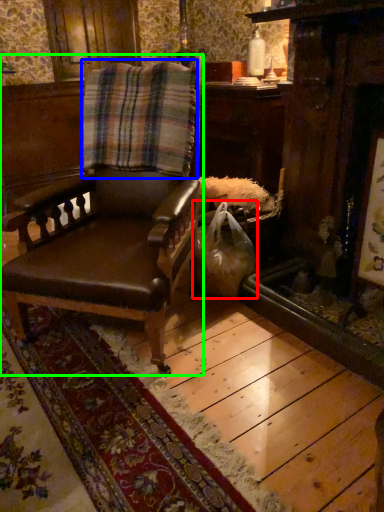
Question: Which object is positioned closest to shopping bag (highlighted by a red box)? Select from blanket (highlighted by a blue box) and chair (highlighted by a green box).

Choices:
 (A) blanket
 (B) chair

Answer: (B)